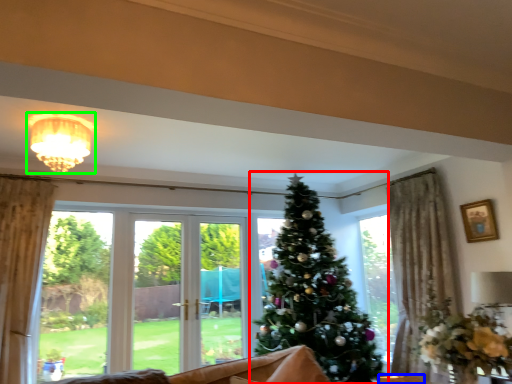
Question: Which is farther away from christmas tree (highlighted by a red box)? furniture (highlighted by a blue box) or light fixture (highlighted by a green box)?

Choices:
 (A) furniture
 (B) light fixture

Answer: (B)